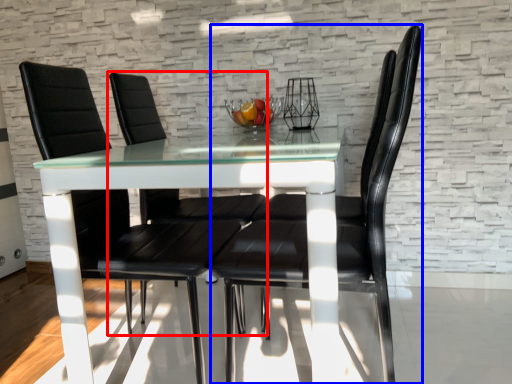
Question: Which point is further to the camera, chair (highlighted by a red box) or chair (highlighted by a blue box)?

Choices:
 (A) chair
 (B) chair

Answer: (A)